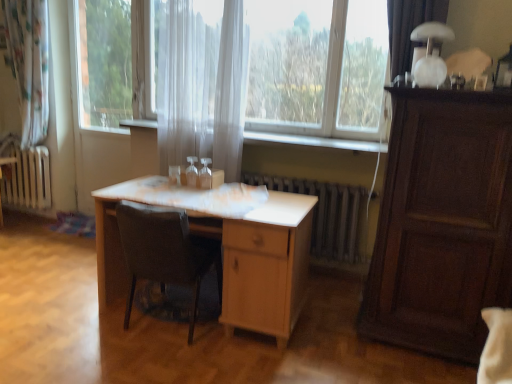
Question: Would you consider transparent glass screen door at center to be distant from light wood table at center?

Choices:
 (A) yes
 (B) no

Answer: (A)

Question: Does transparent glass screen door at center have a smaller size compared to light wood table at center?

Choices:
 (A) no
 (B) yes

Answer: (B)

Question: Considering the relative sizes of transparent glass screen door at center and light wood table at center in the image provided, is transparent glass screen door at center thinner than light wood table at center?

Choices:
 (A) no
 (B) yes

Answer: (B)

Question: Is transparent glass screen door at center not inside light wood table at center?

Choices:
 (A) yes
 (B) no

Answer: (A)

Question: From the image's perspective, does transparent glass screen door at center appear higher than light wood table at center?

Choices:
 (A) no
 (B) yes

Answer: (B)

Question: Can you confirm if transparent glass screen door at center is bigger than light wood table at center?

Choices:
 (A) no
 (B) yes

Answer: (A)

Question: Is transparent glass screen door at center positioned behind white metallic radiator at center?

Choices:
 (A) no
 (B) yes

Answer: (B)

Question: Is transparent glass screen door at center completely or partially outside of white metallic radiator at center?

Choices:
 (A) no
 (B) yes

Answer: (B)

Question: Is white metallic radiator at center at the back of transparent glass screen door at center?

Choices:
 (A) no
 (B) yes

Answer: (A)

Question: From a real-world perspective, is transparent glass screen door at center below white metallic radiator at center?

Choices:
 (A) yes
 (B) no

Answer: (B)

Question: From the image's perspective, would you say transparent glass screen door at center is positioned over white metallic radiator at center?

Choices:
 (A) no
 (B) yes

Answer: (B)

Question: Considering the relative positions of transparent glass screen door at center and white metallic radiator at center in the image provided, is transparent glass screen door at center to the right of white metallic radiator at center from the viewer's perspective?

Choices:
 (A) no
 (B) yes

Answer: (A)

Question: From the image's perspective, is white glossy table lamp at upper right located above transparent glass screen door at center?

Choices:
 (A) no
 (B) yes

Answer: (B)